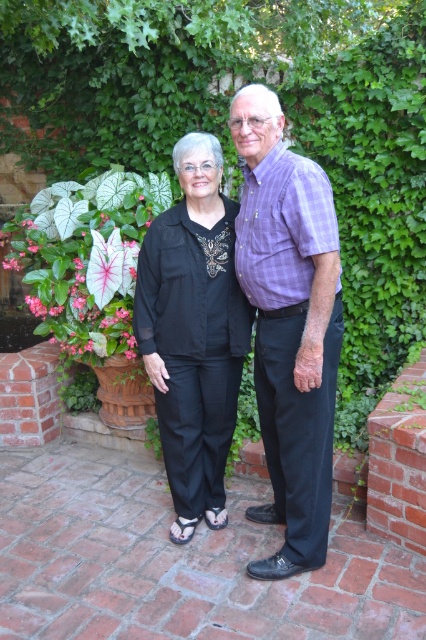
Is point (230, 371) positioned in front of point (51, 193)?

Yes.

Is black cotton pants at center thinner than white matte caladium leaf at center?

Correct, black cotton pants at center's width is less than white matte caladium leaf at center's.

This screenshot has width=426, height=640. I want to click on black cotton pants at center, so click(x=193, y=332).

Between purple checkered shirt at center and black cotton pants at center, which one appears on the right side from the viewer's perspective?

Positioned to the right is purple checkered shirt at center.

Does purple checkered shirt at center come in front of black cotton pants at center?

That is True.

Does point (273, 512) come behind point (184, 156)?

Yes, point (273, 512) is behind point (184, 156).

Find the location of a particular element. The width and height of the screenshot is (426, 640). purple checkered shirt at center is located at coordinates (288, 324).

Between purple checkered shirt at center and white matte caladium leaf at center, which one appears on the right side from the viewer's perspective?

From the viewer's perspective, purple checkered shirt at center appears more on the right side.

Which is below, purple checkered shirt at center or white matte caladium leaf at center?

Positioned lower is purple checkered shirt at center.

Which is in front, point (302, 253) or point (57, 198)?

Positioned in front is point (302, 253).

You are a GUI agent. You are given a task and a screenshot of the screen. Output one action in this format:
    pyautogui.click(x=<x>, y=<y>)
    Task: Click on the purple checkered shirt at center
    The image size is (426, 640).
    Given the screenshot: What is the action you would take?
    pyautogui.click(x=288, y=324)